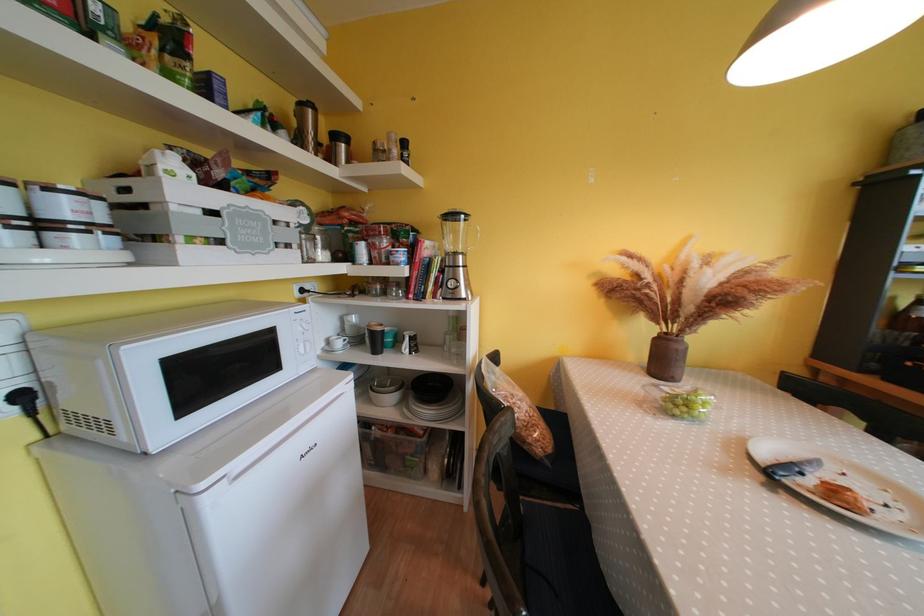
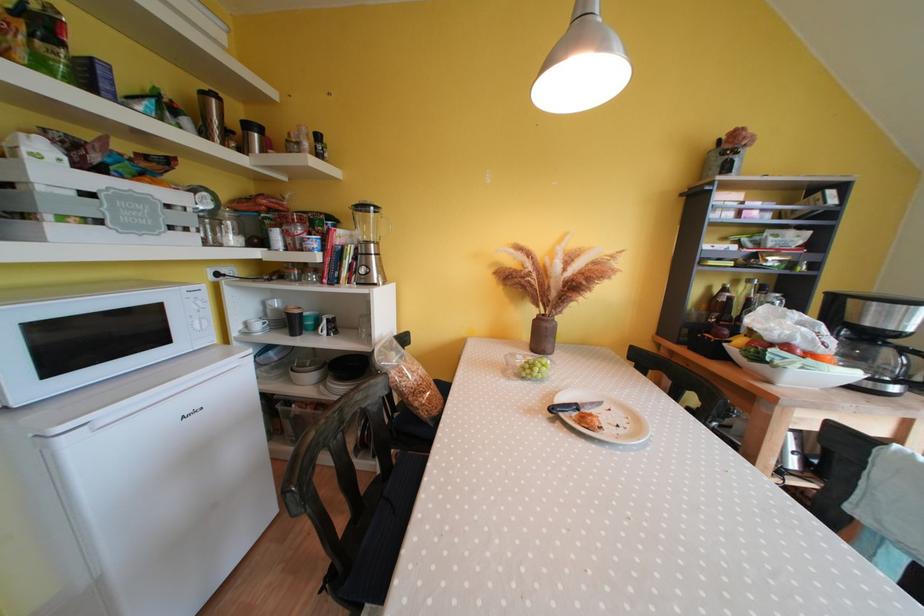
Find the pixel in the second image that matches the point at 467,260 in the first image.

(379, 249)